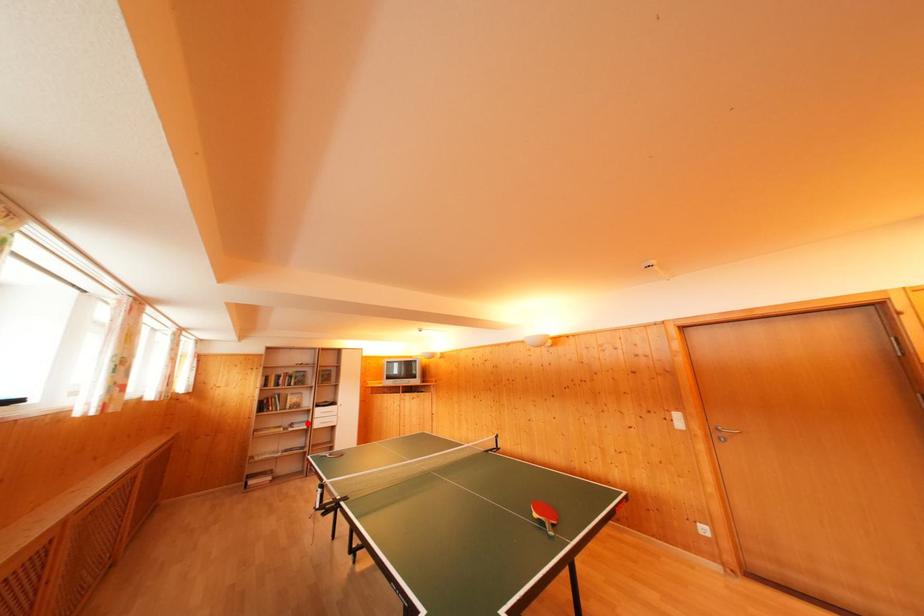
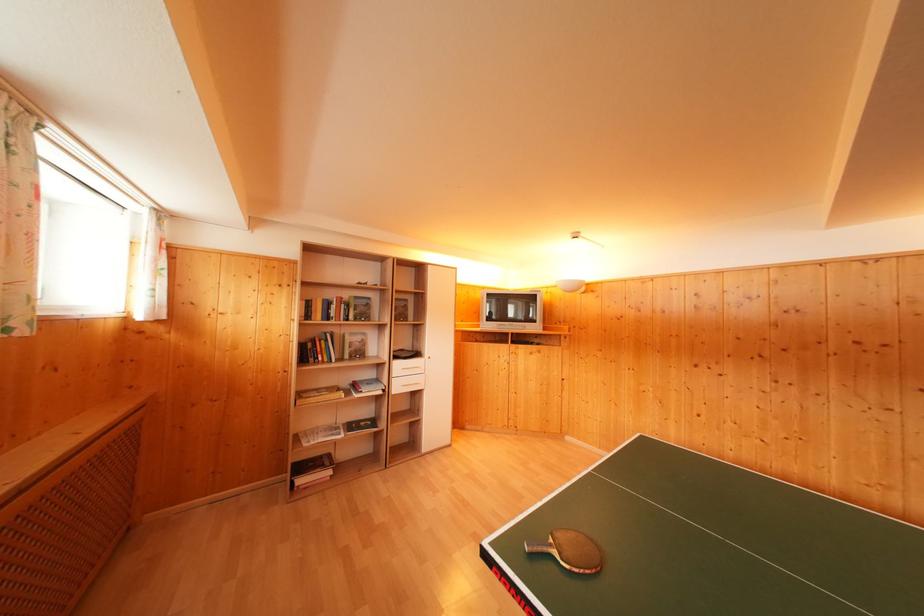
Locate, in the second image, the point that corresponds to the highlighted location in the first image.

(375, 379)